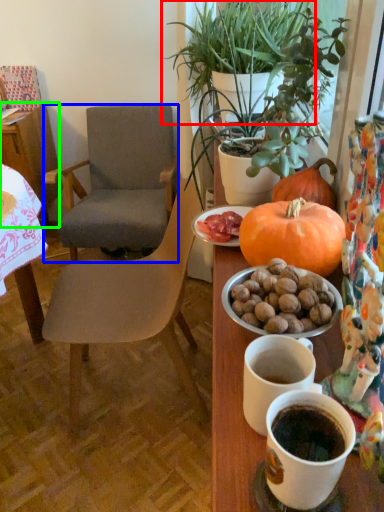
Question: Estimate the real-world distances between objects in this image. Which object is closer to houseplant (highlighted by a red box), chair (highlighted by a blue box) or table (highlighted by a green box)?

Choices:
 (A) chair
 (B) table

Answer: (A)